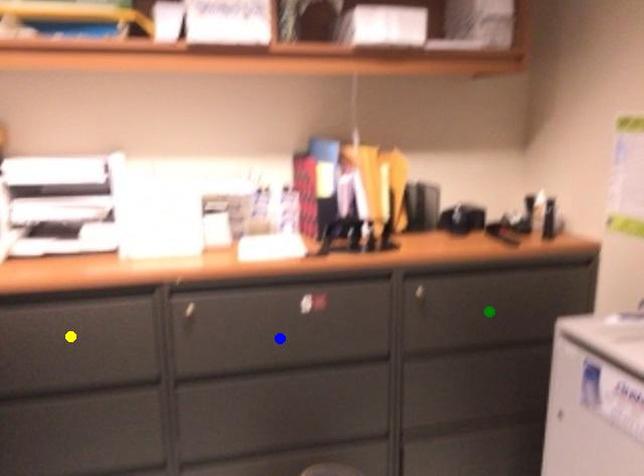
Order these from farthest to nearest:
blue point, yellow point, green point

green point → blue point → yellow point